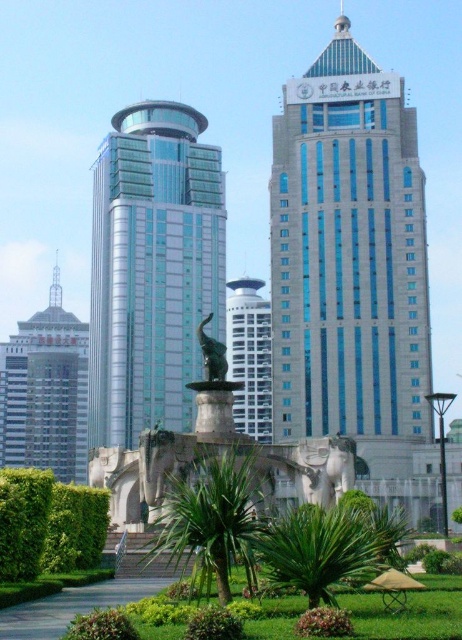
Question: Can you confirm if green leafy hedge at lower left is positioned below white glossy tower at center?

Choices:
 (A) no
 (B) yes

Answer: (B)

Question: Can you confirm if green glass building at center is positioned above matte silver tower at left?

Choices:
 (A) yes
 (B) no

Answer: (A)

Question: Which point is farther to the camera?

Choices:
 (A) (339, 301)
 (B) (208, 364)

Answer: (A)

Question: Which object is positioned farthest from the matte silver tower at left?

Choices:
 (A) bronze statue at center
 (B) green glass building at center

Answer: (A)

Question: Is green glass building at center bigger than green leafy hedge at lower left?

Choices:
 (A) no
 (B) yes

Answer: (B)

Question: Considering the real-world distances, which object is farthest from the white glossy tower at center?

Choices:
 (A) light gray glass skyscraper at center
 (B) bronze statue at center

Answer: (B)